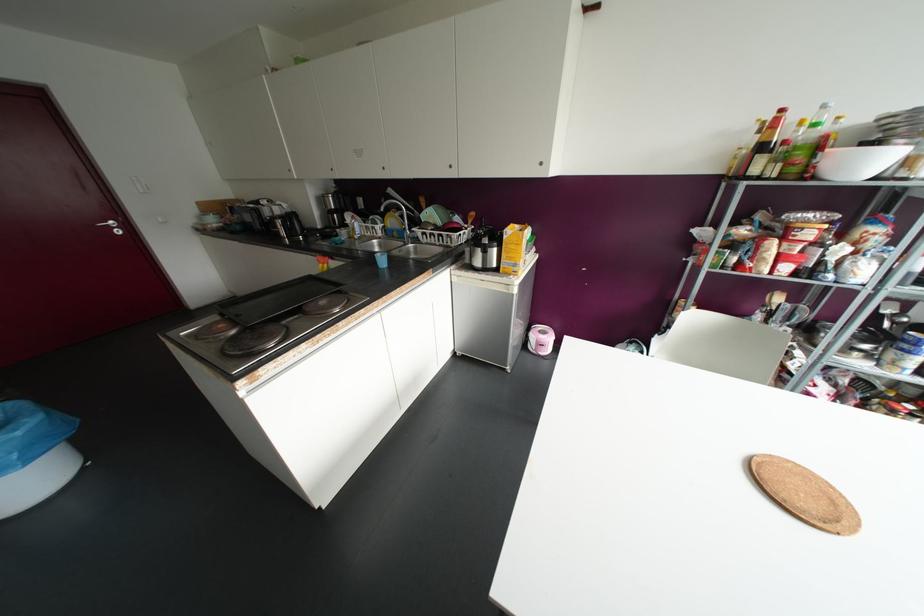
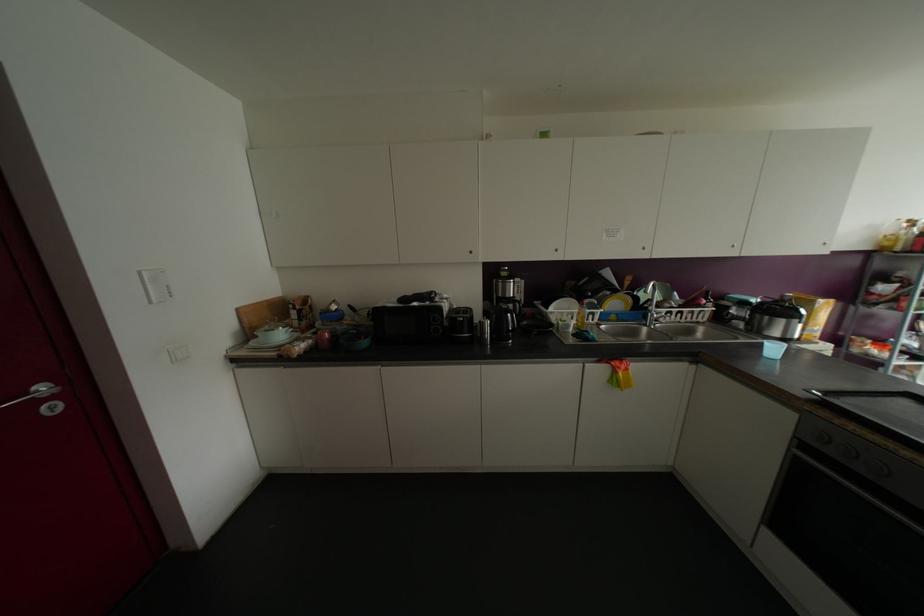
In the second image, find the point that corresponds to point 432,241 in the first image.

(677, 318)